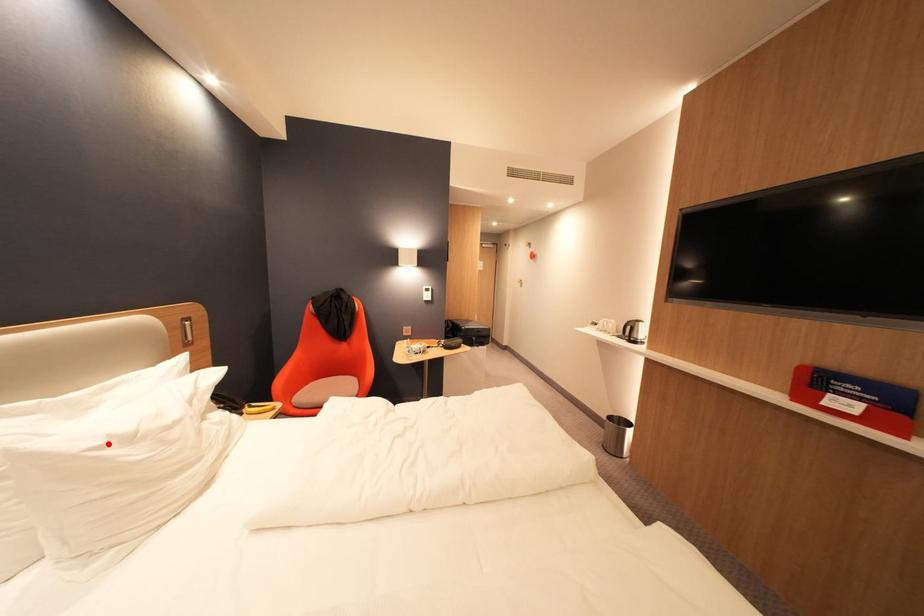
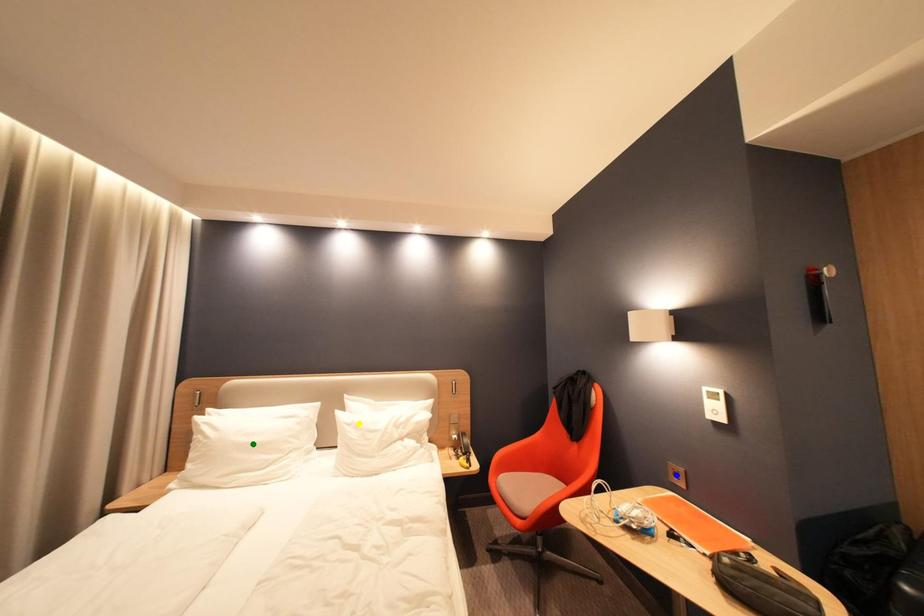
Question: I am providing you with two images of the same scene from different viewpoints. A red point is marked on the first image. You are given multiple points on the second image. Which spot in image 2 lines up with the point in image 1?

Choices:
 (A) yellow point
 (B) blue point
 (C) green point

Answer: (A)